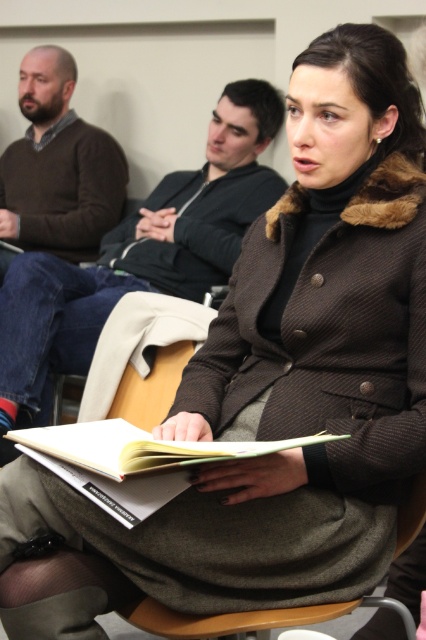
Between brown sweater at center and matte brown sweater at left, which one is positioned higher?

Positioned higher is matte brown sweater at left.

Who is positioned more to the right, brown sweater at center or matte brown sweater at left?

From the viewer's perspective, brown sweater at center appears more on the right side.

Who is more distant from viewer, (51, 330) or (57, 220)?

The point (57, 220) is more distant.

Locate an element on the screen. The image size is (426, 640). brown sweater at center is located at coordinates (138, 257).

Does matte brown sweater at left have a smaller size compared to white paper book at center?

Actually, matte brown sweater at left might be larger than white paper book at center.

Who is shorter, matte brown sweater at left or white paper book at center?

Standing shorter between the two is white paper book at center.

What do you see at coordinates (57, 166) in the screenshot?
I see `matte brown sweater at left` at bounding box center [57, 166].

Where is `matte brown sweater at left`? This screenshot has width=426, height=640. matte brown sweater at left is located at coordinates (57, 166).

Is brown sweater at center below white paper book at center?

No, brown sweater at center is not below white paper book at center.

Which is more to the left, brown sweater at center or white paper book at center?

Positioned to the left is brown sweater at center.

Between point (72, 275) and point (135, 493), which one is positioned behind?

The point (72, 275) is more distant.

The image size is (426, 640). What are the coordinates of `brown sweater at center` in the screenshot? It's located at (138, 257).